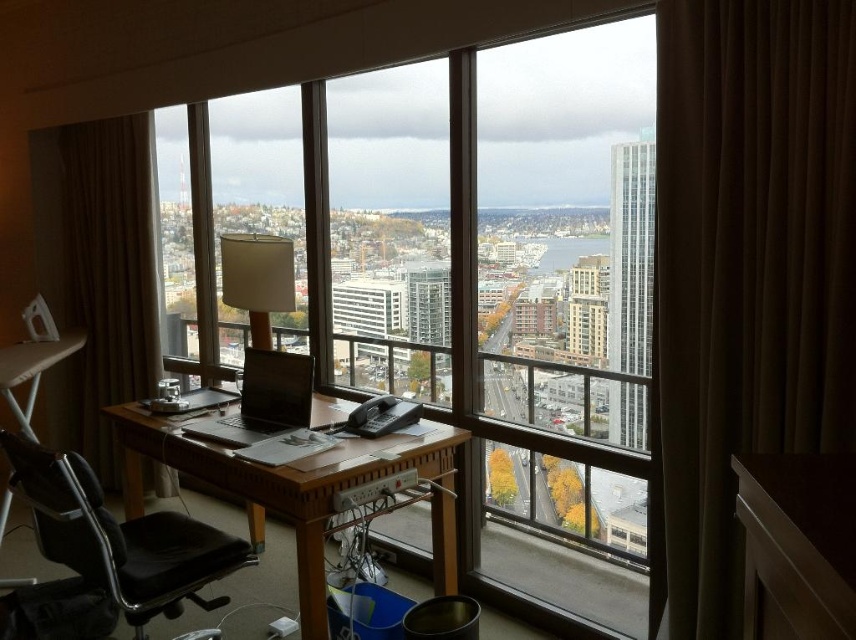
Question: Which of the following is the closest to the observer?

Choices:
 (A) woodendesk at center
 (B) matte black laptop at center
 (C) white fabric lampshade at center

Answer: (A)

Question: Can you confirm if matte black laptop at center is bigger than white fabric lampshade at center?

Choices:
 (A) no
 (B) yes

Answer: (B)

Question: Is transparent glass window at center to the left of white fabric lampshade at center from the viewer's perspective?

Choices:
 (A) yes
 (B) no

Answer: (B)

Question: Among these objects, which one is nearest to the camera?

Choices:
 (A) woodendesk at center
 (B) matte black laptop at center
 (C) black leather swivel chair at left

Answer: (C)

Question: Which point appears farthest from the camera in this image?

Choices:
 (A) (169, 589)
 (B) (269, 486)
 (C) (254, 442)

Answer: (C)

Question: Does woodendesk at center appear on the right side of matte black laptop at center?

Choices:
 (A) yes
 (B) no

Answer: (B)